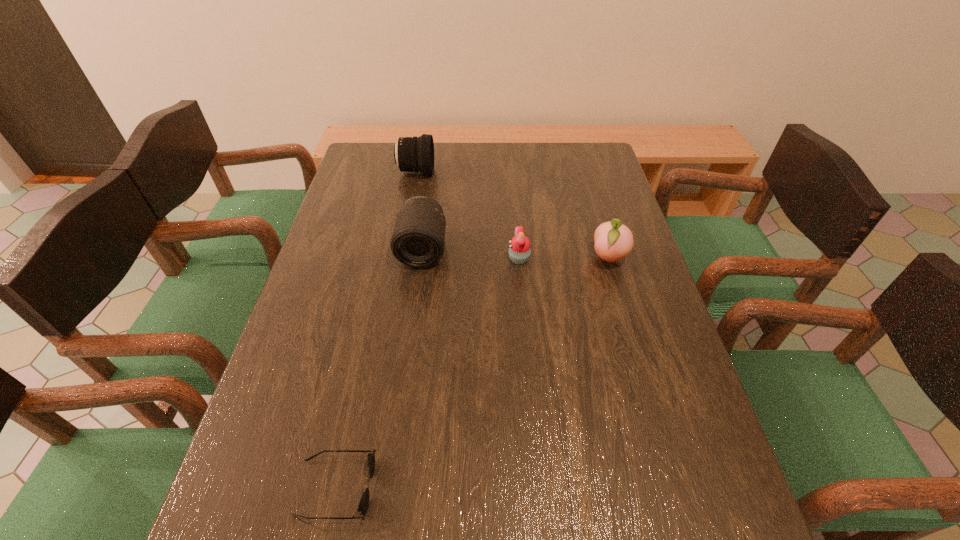
Where is `vacant space that is in between the nearer telephoto lens and the nearest object`? This screenshot has width=960, height=540. vacant space that is in between the nearer telephoto lens and the nearest object is located at coordinates (379, 368).

Identify which object is located as the third nearest to the farthest object. Please provide its 2D coordinates. Your answer should be formatted as a tuple, i.e. [(x, y)], where the tuple contains the x and y coordinates of a point satisfying the conditions above.

[(613, 241)]

This screenshot has height=540, width=960. Find the location of `object that is the fourth closest one to the nearer telephoto lens`. object that is the fourth closest one to the nearer telephoto lens is located at coordinates (364, 502).

Identify the location of vacant space that satisfies the following two spatial constraints: 1. at the front element of the farther telephoto lens; 2. on the left side of the peach. The image size is (960, 540). (400, 258).

The height and width of the screenshot is (540, 960). Identify the location of free spot that satisfies the following two spatial constraints: 1. on the front side of the peach; 2. on the front-facing side of the shortest object. (676, 488).

Locate an element on the screen. The image size is (960, 540). free space in the image that satisfies the following two spatial constraints: 1. at the front element of the farther telephoto lens; 2. on the right side of the peach is located at coordinates (400, 258).

At what (x,y) coordinates should I click in order to perform the action: click on blank area in the image that satisfies the following two spatial constraints: 1. on the surface of the nearer telephoto lens; 2. on the right side of the rightmost object. Please return your answer as a coordinate pair (x, y). This screenshot has width=960, height=540. Looking at the image, I should click on (421, 258).